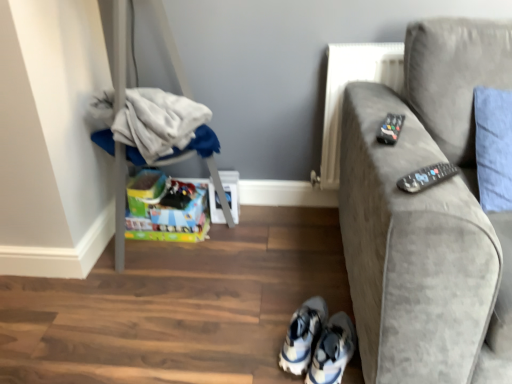
Question: Considering the positions of point (413, 175) and point (308, 342), is point (413, 175) closer or farther from the camera than point (308, 342)?

Choices:
 (A) farther
 (B) closer

Answer: (B)

Question: From the image's perspective, is black plastic remote at right, which is the 2th remote from back to front, located above or below white mesh sneakers at lower center, the first footwear from the left?

Choices:
 (A) below
 (B) above

Answer: (B)

Question: Based on their relative distances, which object is farther from the velvet gray couch at right?

Choices:
 (A) white fabric at left
 (B) white mesh sneakers at lower center, the first footwear from the left
 (C) white synthetic sneakers at lower center, which ranks as the 1th footwear in right-to-left order
 (D) black plastic remote at right, arranged as the 1th remote when ordered from the bottom
 (E) black plastic remote at upper right, the first remote in the top-to-bottom sequence

Answer: (A)

Question: Considering the real-world distances, which object is closest to the velvet gray couch at right?

Choices:
 (A) black plastic remote at right, which is the 1th remote from front to back
 (B) black plastic remote at upper right, the first remote in the top-to-bottom sequence
 (C) white mesh sneakers at lower center, the first footwear from the left
 (D) white synthetic sneakers at lower center, the 2th footwear when ordered from left to right
 (E) white fabric at left

Answer: (B)